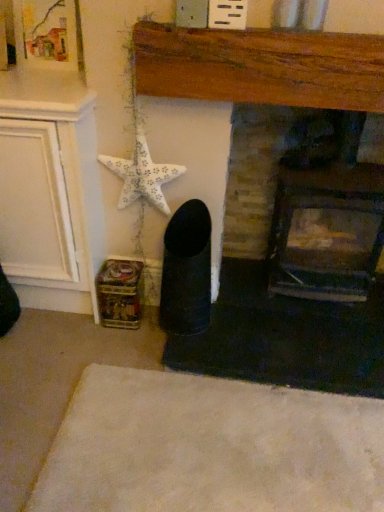
Locate an element on the screen. This screenshot has height=512, width=384. dark brick fireplace at center, the 1th fireplace from the right is located at coordinates (312, 209).

What do you see at coordinates (312, 209) in the screenshot?
I see `dark brick fireplace at center, the 1th fireplace from the right` at bounding box center [312, 209].

You are a GUI agent. You are given a task and a screenshot of the screen. Output one action in this format:
    pyautogui.click(x=<x>, y=<y>)
    Task: Click on the white soft rug at lower center
    The width and height of the screenshot is (384, 512).
    Given the screenshot: What is the action you would take?
    pyautogui.click(x=210, y=447)

Between wooden fireplace at center, the first fireplace positioned from the left, and dark brick fireplace at center, the 2th fireplace when ordered from left to right, which one appears on the left side from the viewer's perspective?

wooden fireplace at center, the first fireplace positioned from the left.

Is point (359, 368) closer or farther from the camera than point (273, 254)?

Clearly, point (359, 368) is closer to the camera than point (273, 254).

Is wooden fireplace at center, which is counted as the 2th fireplace, starting from the right, bigger than dark brick fireplace at center, the 2th fireplace when ordered from left to right?

Actually, wooden fireplace at center, which is counted as the 2th fireplace, starting from the right, might be smaller than dark brick fireplace at center, the 2th fireplace when ordered from left to right.

How distant is wooden fireplace at center, the first fireplace positioned from the left, from dark brick fireplace at center, the 2th fireplace when ordered from left to right?

5.10 inches.

From a real-world perspective, is white soft rug at lower center located higher than wooden fireplace at center, which is counted as the 2th fireplace, starting from the right?

No, from a real-world perspective, white soft rug at lower center is not above wooden fireplace at center, which is counted as the 2th fireplace, starting from the right.

Considering the relative sizes of white soft rug at lower center and wooden fireplace at center, the first fireplace positioned from the left, in the image provided, is white soft rug at lower center taller than wooden fireplace at center, the first fireplace positioned from the left,?

No.

Based on the photo, how many degrees apart are the facing directions of white soft rug at lower center and wooden fireplace at center, which is counted as the 2th fireplace, starting from the right?

The facing directions of white soft rug at lower center and wooden fireplace at center, which is counted as the 2th fireplace, starting from the right, are 90.8 degrees apart.

Which point is more forward, (x=131, y=457) or (x=337, y=103)?

The point (x=337, y=103) is more forward.

Is white soft rug at lower center turned away from dark brick fireplace at center, the 2th fireplace when ordered from left to right?

No, white soft rug at lower center's orientation is not away from dark brick fireplace at center, the 2th fireplace when ordered from left to right.

Is dark brick fireplace at center, the 1th fireplace from the right, surrounded by white soft rug at lower center?

No, white soft rug at lower center does not contain dark brick fireplace at center, the 1th fireplace from the right.

Considering the relative positions of white soft rug at lower center and dark brick fireplace at center, the 1th fireplace from the right, in the image provided, is white soft rug at lower center to the left or to the right of dark brick fireplace at center, the 1th fireplace from the right,?

In the image, white soft rug at lower center appears on the left side of dark brick fireplace at center, the 1th fireplace from the right.

Which fireplace is the 2nd one when counting from the back of the white soft rug at lower center? Please provide its 2D coordinates.

[(312, 209)]

Which of these two, wooden fireplace at center, which is counted as the 2th fireplace, starting from the right, or white matte starfish at upper left, is bigger?

wooden fireplace at center, which is counted as the 2th fireplace, starting from the right, is bigger.

Can you confirm if wooden fireplace at center, which is counted as the 2th fireplace, starting from the right, is shorter than white matte starfish at upper left?

In fact, wooden fireplace at center, which is counted as the 2th fireplace, starting from the right, may be taller than white matte starfish at upper left.

Looking at this image, in terms of width, does wooden fireplace at center, which is counted as the 2th fireplace, starting from the right, look wider or thinner when compared to white matte starfish at upper left?

Considering their sizes, wooden fireplace at center, which is counted as the 2th fireplace, starting from the right, looks slimmer than white matte starfish at upper left.

Could you tell me if wooden fireplace at center, which is counted as the 2th fireplace, starting from the right, is facing white matte starfish at upper left?

Yes, wooden fireplace at center, which is counted as the 2th fireplace, starting from the right, is facing white matte starfish at upper left.

Is point (287, 219) less distant than point (330, 313)?

Yes, it is in front of point (330, 313).

What's the angular difference between dark brick fireplace at center, the 2th fireplace when ordered from left to right, and wooden fireplace at center, which is counted as the 2th fireplace, starting from the right,'s facing directions?

They differ by 1.02 degrees in their facing directions.

Which is correct: dark brick fireplace at center, the 2th fireplace when ordered from left to right, is inside wooden fireplace at center, which is counted as the 2th fireplace, starting from the right, or outside of it?

dark brick fireplace at center, the 2th fireplace when ordered from left to right, lies outside wooden fireplace at center, which is counted as the 2th fireplace, starting from the right.

Is dark brick fireplace at center, the 2th fireplace when ordered from left to right, to the left or to the right of wooden fireplace at center, which is counted as the 2th fireplace, starting from the right, in the image?

In the image, dark brick fireplace at center, the 2th fireplace when ordered from left to right, appears on the right side of wooden fireplace at center, which is counted as the 2th fireplace, starting from the right.

Is dark brick fireplace at center, the 2th fireplace when ordered from left to right, not close to white matte starfish at upper left?

No, dark brick fireplace at center, the 2th fireplace when ordered from left to right, is not far away from white matte starfish at upper left.

Can you tell me how much dark brick fireplace at center, the 1th fireplace from the right, and white matte starfish at upper left differ in facing direction?

The angular difference between dark brick fireplace at center, the 1th fireplace from the right, and white matte starfish at upper left is 1.47 degrees.

Is dark brick fireplace at center, the 2th fireplace when ordered from left to right, taller or shorter than white matte starfish at upper left?

Clearly, dark brick fireplace at center, the 2th fireplace when ordered from left to right, is taller compared to white matte starfish at upper left.

Is point (369, 169) farther from camera compared to point (160, 188)?

Yes, it is behind point (160, 188).

Would you say white matte starfish at upper left is a long distance from white soft rug at lower center?

No, white matte starfish at upper left is not far from white soft rug at lower center.

Image resolution: width=384 pixels, height=512 pixels. I want to click on plain below the white matte starfish at upper left (from a real-world perspective), so click(210, 447).

How different are the orientations of white matte starfish at upper left and white soft rug at lower center in degrees?

There is a 91.2-degree angle between the facing directions of white matte starfish at upper left and white soft rug at lower center.

Locate an element on the screen. This screenshot has width=384, height=512. fireplace that appears above the dark brick fireplace at center, the 2th fireplace when ordered from left to right (from a real-world perspective) is located at coordinates (299, 298).

Where is `plain in front of the wooden fireplace at center, which is counted as the 2th fireplace, starting from the right`? Image resolution: width=384 pixels, height=512 pixels. plain in front of the wooden fireplace at center, which is counted as the 2th fireplace, starting from the right is located at coordinates pyautogui.click(x=210, y=447).

Which object lies further to the anchor point white matte starfish at upper left, wooden fireplace at center, which is counted as the 2th fireplace, starting from the right, or white soft rug at lower center?

white soft rug at lower center.

When comparing their distances from wooden fireplace at center, the first fireplace positioned from the left, does white soft rug at lower center or white matte starfish at upper left seem further?

The object further to wooden fireplace at center, the first fireplace positioned from the left, is white matte starfish at upper left.

From the image, which object appears to be nearer to dark brick fireplace at center, the 2th fireplace when ordered from left to right, wooden fireplace at center, which is counted as the 2th fireplace, starting from the right, or white matte starfish at upper left?

Among the two, wooden fireplace at center, which is counted as the 2th fireplace, starting from the right, is located nearer to dark brick fireplace at center, the 2th fireplace when ordered from left to right.

Which object lies nearer to the anchor point dark brick fireplace at center, the 2th fireplace when ordered from left to right, white soft rug at lower center or white matte starfish at upper left?

white matte starfish at upper left is closer to dark brick fireplace at center, the 2th fireplace when ordered from left to right.

Which object lies nearer to the anchor point white soft rug at lower center, white matte starfish at upper left or dark brick fireplace at center, the 2th fireplace when ordered from left to right?

The object closer to white soft rug at lower center is dark brick fireplace at center, the 2th fireplace when ordered from left to right.

Looking at the image, which one is located further to wooden fireplace at center, which is counted as the 2th fireplace, starting from the right, white matte starfish at upper left or dark brick fireplace at center, the 1th fireplace from the right?

Among the two, white matte starfish at upper left is located further to wooden fireplace at center, which is counted as the 2th fireplace, starting from the right.

From the image, which object appears to be nearer to white matte starfish at upper left, wooden fireplace at center, which is counted as the 2th fireplace, starting from the right, or dark brick fireplace at center, the 2th fireplace when ordered from left to right?

Among the two, dark brick fireplace at center, the 2th fireplace when ordered from left to right, is located nearer to white matte starfish at upper left.

Estimate the real-world distances between objects in this image. Which object is closer to wooden fireplace at center, which is counted as the 2th fireplace, starting from the right, white soft rug at lower center or dark brick fireplace at center, the 1th fireplace from the right?

Based on the image, dark brick fireplace at center, the 1th fireplace from the right, appears to be nearer to wooden fireplace at center, which is counted as the 2th fireplace, starting from the right.

Locate an element on the screen. This screenshot has height=512, width=384. fireplace that lies between wooden fireplace at center, the first fireplace positioned from the left, and white soft rug at lower center from top to bottom is located at coordinates (312, 209).

Identify the location of fireplace between white matte starfish at upper left and dark brick fireplace at center, the 2th fireplace when ordered from left to right. (299, 298).